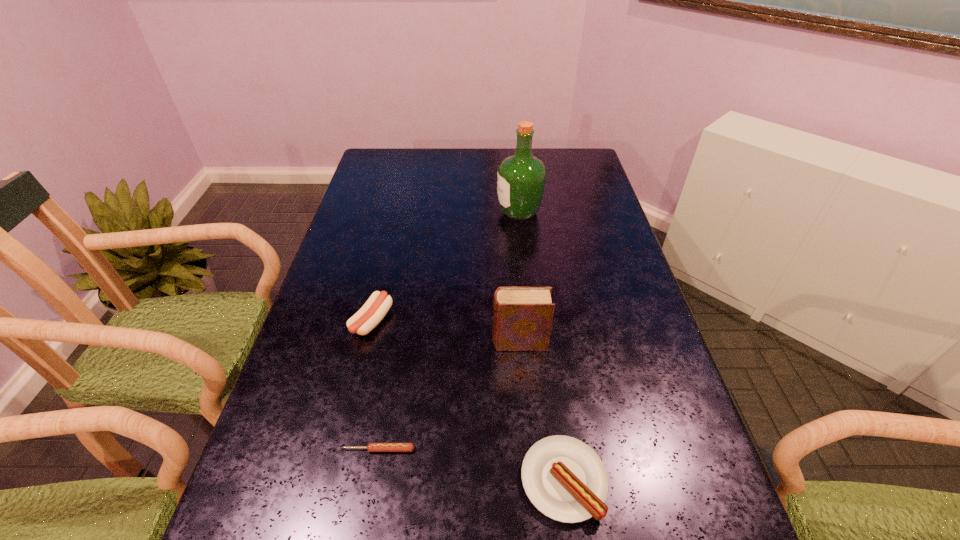
The height and width of the screenshot is (540, 960). I want to click on liquor, so click(521, 177).

This screenshot has width=960, height=540. Identify the location of the tallest object. (521, 177).

This screenshot has width=960, height=540. I want to click on diary, so click(522, 316).

Find the location of a particular element. The height and width of the screenshot is (540, 960). the farthest sausage is located at coordinates [x=376, y=307].

At what (x,y) coordinates should I click in order to perform the action: click on the tallest sausage. Please return your answer as a coordinate pair (x, y). The width and height of the screenshot is (960, 540). Looking at the image, I should click on (376, 307).

You are a GUI agent. You are given a task and a screenshot of the screen. Output one action in this format:
    pyautogui.click(x=<x>, y=<y>)
    Task: Click on the rightmost sausage
    The image size is (960, 540).
    Given the screenshot: What is the action you would take?
    pyautogui.click(x=564, y=478)

You are a GUI agent. You are given a task and a screenshot of the screen. Output one action in this format:
    pyautogui.click(x=<x>, y=<y>)
    Task: Click on the second shortest sausage
    
    Given the screenshot: What is the action you would take?
    pyautogui.click(x=564, y=478)

Identify the location of the shortest sausage. (371, 447).

The image size is (960, 540). Find the location of `vacant area located on the front-facing side of the liquor`. vacant area located on the front-facing side of the liquor is located at coordinates (397, 212).

You are a GUI agent. You are given a task and a screenshot of the screen. Output one action in this format:
    pyautogui.click(x=<x>, y=<y>)
    Task: Click on the vacant space located on the front-facing side of the liquor
    
    Given the screenshot: What is the action you would take?
    pyautogui.click(x=424, y=212)